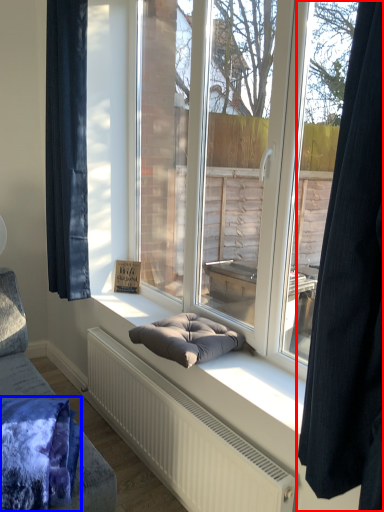
Question: Which point is closer to the camera, curtain (highlighted by a red box) or blanket (highlighted by a blue box)?

Choices:
 (A) curtain
 (B) blanket

Answer: (A)